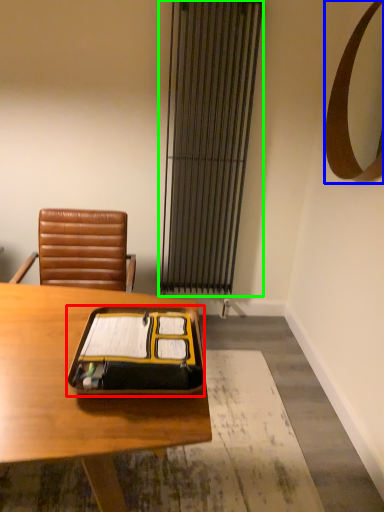
Question: Estimate the real-world distances between objects in this image. Which object is farther from notebook (highlighted by a red box), mirror (highlighted by a blue box) or curtain (highlighted by a green box)?

Choices:
 (A) mirror
 (B) curtain

Answer: (B)